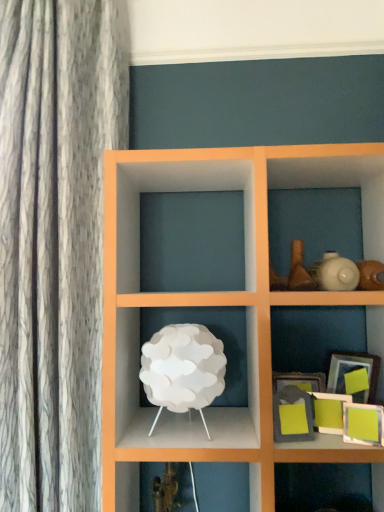
Question: Considering the relative sizes of matte gray picture frame at lower right, which is the fourth picture frame from back to front, and matte green picture frame at lower right, placed as the fifth picture frame when sorted from back to front, in the image provided, is matte gray picture frame at lower right, which is the fourth picture frame from back to front, smaller than matte green picture frame at lower right, placed as the fifth picture frame when sorted from back to front,?

Choices:
 (A) yes
 (B) no

Answer: (B)

Question: Would you say matte gray picture frame at lower right, placed as the 2th picture frame when sorted from front to back, is a long distance from matte green picture frame at lower right, placed as the fifth picture frame when sorted from back to front?

Choices:
 (A) yes
 (B) no

Answer: (B)

Question: Could matte green picture frame at lower right, the 1th picture frame in the front-to-back sequence, be considered to be inside matte gray picture frame at lower right, which is the fourth picture frame from back to front?

Choices:
 (A) no
 (B) yes

Answer: (A)

Question: Considering the relative sizes of matte gray picture frame at lower right, which is the fourth picture frame from back to front, and matte green picture frame at lower right, placed as the fifth picture frame when sorted from back to front, in the image provided, is matte gray picture frame at lower right, which is the fourth picture frame from back to front, thinner than matte green picture frame at lower right, placed as the fifth picture frame when sorted from back to front,?

Choices:
 (A) yes
 (B) no

Answer: (B)

Question: Does matte gray picture frame at lower right, placed as the 2th picture frame when sorted from front to back, appear on the right side of matte green picture frame at lower right, placed as the fifth picture frame when sorted from back to front?

Choices:
 (A) yes
 (B) no

Answer: (B)

Question: Looking at their shapes, would you say matte gray picture frame at lower right, placed as the 2th picture frame when sorted from front to back, is wider or thinner than white matte/porcelain table lamp at center?

Choices:
 (A) thin
 (B) wide

Answer: (A)

Question: In the image, is matte gray picture frame at lower right, which is the fourth picture frame from back to front, on the left side or the right side of white matte/porcelain table lamp at center?

Choices:
 (A) right
 (B) left

Answer: (A)

Question: Is point (278, 401) closer or farther from the camera than point (183, 345)?

Choices:
 (A) closer
 (B) farther

Answer: (B)

Question: Based on their sizes in the image, would you say matte gray picture frame at lower right, which is the fourth picture frame from back to front, is bigger or smaller than white matte/porcelain table lamp at center?

Choices:
 (A) big
 (B) small

Answer: (B)

Question: Which is correct: matte green picture frame at lower right, marked as the third picture frame in a back-to-front arrangement, is inside matte gray picture frame at lower right, placed as the 2th picture frame when sorted from front to back, or outside of it?

Choices:
 (A) inside
 (B) outside

Answer: (B)

Question: Based on their positions, is matte green picture frame at lower right, marked as the third picture frame in a back-to-front arrangement, located to the left or right of matte gray picture frame at lower right, placed as the 2th picture frame when sorted from front to back?

Choices:
 (A) left
 (B) right

Answer: (B)

Question: In the image, is matte green picture frame at lower right, the 3th picture frame in the front-to-back sequence, positioned in front of or behind matte gray picture frame at lower right, placed as the 2th picture frame when sorted from front to back?

Choices:
 (A) behind
 (B) front

Answer: (A)

Question: From the image's perspective, is matte green picture frame at lower right, marked as the third picture frame in a back-to-front arrangement, above or below matte gray picture frame at lower right, placed as the 2th picture frame when sorted from front to back?

Choices:
 (A) above
 (B) below

Answer: (B)

Question: In terms of width, does matte gray picture frame at lower right, which is the fourth picture frame from back to front, look wider or thinner when compared to matte gray picture frame at lower right, positioned as the fifth picture frame in front-to-back order?

Choices:
 (A) wide
 (B) thin

Answer: (B)

Question: From a real-world perspective, is matte gray picture frame at lower right, placed as the 2th picture frame when sorted from front to back, physically located above or below matte gray picture frame at lower right, the first picture frame viewed from the back?

Choices:
 (A) below
 (B) above

Answer: (A)